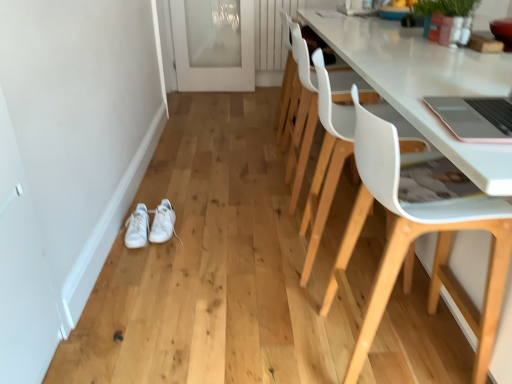
Question: Is white leather sneakers at lower left, marked as the 2th footwear in a left-to-right arrangement, not within white leather sneakers at lower left, which is counted as the first footwear, starting from the left?

Choices:
 (A) no
 (B) yes

Answer: (B)

Question: From a real-world perspective, is white leather sneakers at lower left, marked as the 2th footwear in a left-to-right arrangement, on top of white leather sneakers at lower left, which is counted as the first footwear, starting from the left?

Choices:
 (A) yes
 (B) no

Answer: (A)

Question: Does white leather sneakers at lower left, which is counted as the 1th footwear, starting from the right, have a greater height compared to white leather sneakers at lower left, which is counted as the first footwear, starting from the left?

Choices:
 (A) no
 (B) yes

Answer: (A)

Question: From the image's perspective, is white leather sneakers at lower left, marked as the 2th footwear in a left-to-right arrangement, under white leather sneakers at lower left, which is counted as the first footwear, starting from the left?

Choices:
 (A) no
 (B) yes

Answer: (A)

Question: In terms of size, does white plastic chair at center, positioned as the third chair in front-to-back order, appear bigger or smaller than white plastic chair at right, which is the 3th chair in back-to-front order?

Choices:
 (A) big
 (B) small

Answer: (B)

Question: Does point (295, 87) appear closer or farther from the camera than point (412, 230)?

Choices:
 (A) closer
 (B) farther

Answer: (B)

Question: Is white plastic chair at center, positioned as the third chair in front-to-back order, inside or outside of white plastic chair at right, which is the 3th chair in back-to-front order?

Choices:
 (A) outside
 (B) inside

Answer: (A)

Question: In the image, is white plastic chair at center, the first chair in the back-to-front sequence, on the left side or the right side of white plastic chair at right, which is the 3th chair in back-to-front order?

Choices:
 (A) right
 (B) left

Answer: (B)

Question: From a real-world perspective, is white plastic chair at right, which appears as the 2th chair when viewed from the front, physically located above or below white leather sneakers at lower left, which is counted as the first footwear, starting from the left?

Choices:
 (A) above
 (B) below

Answer: (A)

Question: In the image, is white plastic chair at right, marked as the second chair in a back-to-front arrangement, positioned in front of or behind white leather sneakers at lower left, which is counted as the first footwear, starting from the left?

Choices:
 (A) behind
 (B) front

Answer: (B)

Question: Considering the relative positions of white plastic chair at right, marked as the second chair in a back-to-front arrangement, and white leather sneakers at lower left, the second footwear from the right, in the image provided, is white plastic chair at right, marked as the second chair in a back-to-front arrangement, to the left or to the right of white leather sneakers at lower left, the second footwear from the right,?

Choices:
 (A) right
 (B) left

Answer: (A)

Question: From their relative heights in the image, would you say white plastic chair at right, which appears as the 2th chair when viewed from the front, is taller or shorter than white leather sneakers at lower left, the second footwear from the right?

Choices:
 (A) tall
 (B) short

Answer: (A)

Question: From a real-world perspective, relative to white leather sneakers at lower left, which is counted as the 1th footwear, starting from the right, is white plastic chair at right, marked as the second chair in a back-to-front arrangement, vertically above or below?

Choices:
 (A) above
 (B) below

Answer: (A)

Question: Relative to white leather sneakers at lower left, marked as the 2th footwear in a left-to-right arrangement, is white plastic chair at right, marked as the second chair in a back-to-front arrangement, in front or behind?

Choices:
 (A) behind
 (B) front

Answer: (B)